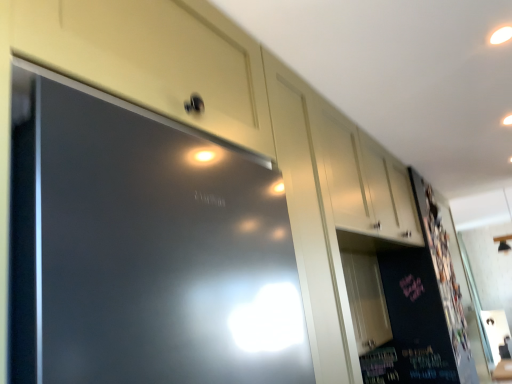
I want to click on dark matte board at right, so click(449, 278).

What is the approximate height of dark matte board at right?

dark matte board at right is 3.74 feet in height.

What do you see at coordinates (449, 278) in the screenshot? This screenshot has width=512, height=384. I see `dark matte board at right` at bounding box center [449, 278].

Find the location of a particular element. Image resolution: width=512 pixels, height=384 pixels. white glossy cabinet at upper center is located at coordinates (338, 162).

Describe the element at coordinates (338, 162) in the screenshot. I see `white glossy cabinet at upper center` at that location.

What is the approximate height of white glossy cabinet at upper center?

white glossy cabinet at upper center is 18.40 inches tall.

Find the location of a particular element. dark matte board at right is located at coordinates (449, 278).

Can you confirm if white glossy cabinet at upper center is positioned to the right of dark matte board at right?

No, white glossy cabinet at upper center is not to the right of dark matte board at right.

Considering their positions, is white glossy cabinet at upper center located in front of or behind dark matte board at right?

white glossy cabinet at upper center is positioned closer to the viewer than dark matte board at right.

Does point (336, 121) come behind point (484, 365)?

No, it is not.

From the image's perspective, which one is positioned lower, white glossy cabinet at upper center or dark matte board at right?

From the image's view, dark matte board at right is below.

From a real-world perspective, which is physically above, white glossy cabinet at upper center or dark matte board at right?

white glossy cabinet at upper center is physically above.

Is white glossy cabinet at upper center wider or thinner than dark matte board at right?

In the image, white glossy cabinet at upper center appears to be wider than dark matte board at right.

Between white glossy cabinet at upper center and dark matte board at right, which one has more height?

Standing taller between the two is dark matte board at right.

Who is bigger, white glossy cabinet at upper center or dark matte board at right?

white glossy cabinet at upper center is bigger.

Is dark matte board at right surrounded by white glossy cabinet at upper center?

No, dark matte board at right is located outside of white glossy cabinet at upper center.

Is the surface of white glossy cabinet at upper center in direct contact with dark matte board at right?

No, white glossy cabinet at upper center is not beside dark matte board at right.

Is white glossy cabinet at upper center looking in the opposite direction of dark matte board at right?

No, white glossy cabinet at upper center's orientation is not away from dark matte board at right.

The image size is (512, 384). I want to click on cabinetry located above the dark matte board at right (from a real-world perspective), so click(338, 162).

Is dark matte board at right at the right side of white glossy cabinet at upper center?

Indeed, dark matte board at right is positioned on the right side of white glossy cabinet at upper center.

Does dark matte board at right come behind white glossy cabinet at upper center?

Yes, dark matte board at right is further from the viewer.

Does point (413, 174) lie in front of point (345, 229)?

That is False.

From the image's perspective, does dark matte board at right appear lower than white glossy cabinet at upper center?

Indeed, from the image's perspective, dark matte board at right is shown beneath white glossy cabinet at upper center.

From a real-world perspective, which is physically above, dark matte board at right or white glossy cabinet at upper center?

white glossy cabinet at upper center, from a real-world perspective.

In terms of width, does dark matte board at right look wider or thinner when compared to white glossy cabinet at upper center?

Clearly, dark matte board at right has less width compared to white glossy cabinet at upper center.

Is dark matte board at right taller or shorter than white glossy cabinet at upper center?

In the image, dark matte board at right appears to be taller than white glossy cabinet at upper center.

Considering the sizes of objects dark matte board at right and white glossy cabinet at upper center in the image provided, who is bigger, dark matte board at right or white glossy cabinet at upper center?

white glossy cabinet at upper center is bigger.

Is dark matte board at right outside of white glossy cabinet at upper center?

That's correct, dark matte board at right is outside of white glossy cabinet at upper center.

Would you consider dark matte board at right to be distant from white glossy cabinet at upper center?

That's right, there is a large distance between dark matte board at right and white glossy cabinet at upper center.

Is dark matte board at right aimed at white glossy cabinet at upper center?

No, dark matte board at right is not turned towards white glossy cabinet at upper center.

Can you tell me how much dark matte board at right and white glossy cabinet at upper center differ in facing direction?

The facing directions of dark matte board at right and white glossy cabinet at upper center are 0.00253 degrees apart.

The image size is (512, 384). Find the location of `bulletin board that is on the right side of white glossy cabinet at upper center`. bulletin board that is on the right side of white glossy cabinet at upper center is located at coordinates (449, 278).

Where is `bulletin board located below the white glossy cabinet at upper center (from the image's perspective)`? This screenshot has height=384, width=512. bulletin board located below the white glossy cabinet at upper center (from the image's perspective) is located at coordinates (449, 278).

Locate an element on the screen. Image resolution: width=512 pixels, height=384 pixels. cabinetry above the dark matte board at right (from a real-world perspective) is located at coordinates (338, 162).